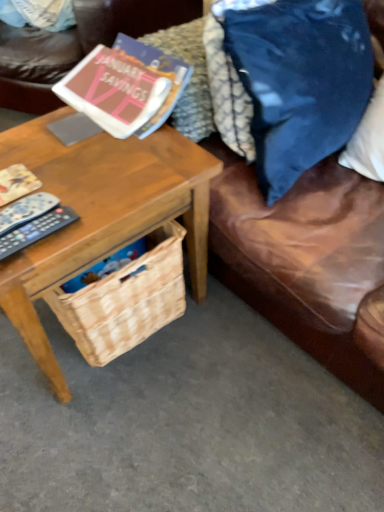
The width and height of the screenshot is (384, 512). What do you see at coordinates (300, 81) in the screenshot?
I see `blue velvet pillow at upper right` at bounding box center [300, 81].

Describe the element at coordinates (26, 210) in the screenshot. I see `black plastic remote at left, the 2th remote control from the bottom` at that location.

The image size is (384, 512). What are the coordinates of `matte paper book at upper left` in the screenshot? It's located at (126, 87).

Is brown leather couch at lower right located within woodenobject at left?

No, brown leather couch at lower right is located outside of woodenobject at left.

Does woodenobject at left turn towards brown leather couch at lower right?

No, woodenobject at left is not facing towards brown leather couch at lower right.

Can you confirm if woodenobject at left is bigger than brown leather couch at lower right?

No.

Is woodenobject at left closer to the viewer compared to brown leather couch at lower right?

No, the depth of woodenobject at left is greater than that of brown leather couch at lower right.

Between blue velvet pillow at upper right and black plastic remote at left, which is the 1th remote control from top to bottom, which one has smaller width?

With smaller width is black plastic remote at left, which is the 1th remote control from top to bottom.

From the image's perspective, is blue velvet pillow at upper right located above black plastic remote at left, which is the 1th remote control from top to bottom?

Yes.

In the scene shown: Is blue velvet pillow at upper right spatially inside black plastic remote at left, the 2th remote control from the bottom, or outside of it?

blue velvet pillow at upper right exists outside the volume of black plastic remote at left, the 2th remote control from the bottom.

Is black plastic remote control at left, the second remote control positioned from the top, with black plastic remote at left, the 2th remote control from the bottom?

Yes, black plastic remote control at left, the second remote control positioned from the top, is in contact with black plastic remote at left, the 2th remote control from the bottom.

From a real-world perspective, is black plastic remote control at left, which is counted as the first remote control, starting from the bottom, above or below black plastic remote at left, which is the 1th remote control from top to bottom?

black plastic remote control at left, which is counted as the first remote control, starting from the bottom, is below black plastic remote at left, which is the 1th remote control from top to bottom.

Is black plastic remote control at left, the second remote control positioned from the top, oriented towards black plastic remote at left, the 2th remote control from the bottom?

No, black plastic remote control at left, the second remote control positioned from the top, does not turn towards black plastic remote at left, the 2th remote control from the bottom.

Based on their positions, is black plastic remote control at left, the second remote control positioned from the top, located to the left or right of black plastic remote at left, the 2th remote control from the bottom?

In the image, black plastic remote control at left, the second remote control positioned from the top, appears on the right side of black plastic remote at left, the 2th remote control from the bottom.

From the image's perspective, between black plastic remote control at left, the second remote control positioned from the top, and brown leather couch at lower right, which one is located above?

From the image's view, brown leather couch at lower right is above.

From the picture: Could you tell me if black plastic remote control at left, which is counted as the first remote control, starting from the bottom, is turned towards brown leather couch at lower right?

No, black plastic remote control at left, which is counted as the first remote control, starting from the bottom, is not facing towards brown leather couch at lower right.

What's the angular difference between black plastic remote control at left, the second remote control positioned from the top, and brown leather couch at lower right's facing directions?

0.705 degrees.

Can you confirm if black plastic remote control at left, the second remote control positioned from the top, is bigger than brown leather couch at lower right?

Actually, black plastic remote control at left, the second remote control positioned from the top, might be smaller than brown leather couch at lower right.

Is black plastic remote at left, the 2th remote control from the bottom, not close to brown leather couch at lower right?

No, black plastic remote at left, the 2th remote control from the bottom, is in close proximity to brown leather couch at lower right.

How different are the orientations of black plastic remote at left, the 2th remote control from the bottom, and brown leather couch at lower right in degrees?

black plastic remote at left, the 2th remote control from the bottom, and brown leather couch at lower right are facing 7.22 degrees away from each other.

Is black plastic remote at left, the 2th remote control from the bottom, facing towards brown leather couch at lower right?

No, black plastic remote at left, the 2th remote control from the bottom, is not oriented towards brown leather couch at lower right.

Based on the photo, can you tell me how much black plastic remote at left, the 2th remote control from the bottom, and woodenobject at left differ in facing direction?

black plastic remote at left, the 2th remote control from the bottom, and woodenobject at left are facing 10.6 degrees away from each other.

Which object is wider, black plastic remote at left, the 2th remote control from the bottom, or woodenobject at left?

woodenobject at left is wider.

Can you confirm if black plastic remote at left, the 2th remote control from the bottom, is taller than woodenobject at left?

In fact, black plastic remote at left, the 2th remote control from the bottom, may be shorter than woodenobject at left.

From a real-world perspective, is black plastic remote at left, the 2th remote control from the bottom, positioned above or below woodenobject at left?

In terms of real-world spatial position, black plastic remote at left, the 2th remote control from the bottom, is above woodenobject at left.

From a real-world perspective, which object stands above the other?

In real-world perspective, black plastic remote at left, the 2th remote control from the bottom, is above.

At what (x,y) coordinates should I click in order to perform the action: click on the 2nd remote control counting from the left of the brown leather couch at lower right. Please return your answer as a coordinate pair (x, y). The height and width of the screenshot is (512, 384). Looking at the image, I should click on (26, 210).

Does brown leather couch at lower right contain black plastic remote at left, the 2th remote control from the bottom?

Actually, black plastic remote at left, the 2th remote control from the bottom, is outside brown leather couch at lower right.

You are a GUI agent. You are given a task and a screenshot of the screen. Output one action in this format:
    pyautogui.click(x=<x>, y=<y>)
    Task: Click on the couch above the woodenobject at left (from the image's perspective)
    The height and width of the screenshot is (512, 384).
    Given the screenshot: What is the action you would take?
    pyautogui.click(x=307, y=261)

Locate an element on the screen. The image size is (384, 512). throw pillow located above the black plastic remote at left, which is the 1th remote control from top to bottom (from a real-world perspective) is located at coordinates (300, 81).

Based on their spatial positions, is black plastic remote control at left, the second remote control positioned from the top, or brown leather couch at lower right closer to blue velvet pillow at upper right?

brown leather couch at lower right lies closer to blue velvet pillow at upper right than the other object.

Estimate the real-world distances between objects in this image. Which object is further from black plastic remote at left, which is the 1th remote control from top to bottom, blue velvet pillow at upper right or woodenobject at left?

The object further to black plastic remote at left, which is the 1th remote control from top to bottom, is blue velvet pillow at upper right.

Based on their spatial positions, is black plastic remote at left, which is the 1th remote control from top to bottom, or blue velvet pillow at upper right closer to woodenobject at left?

The object closer to woodenobject at left is black plastic remote at left, which is the 1th remote control from top to bottom.

Estimate the real-world distances between objects in this image. Which object is closer to black plastic remote control at left, which is counted as the first remote control, starting from the bottom, brown leather couch at lower right or black plastic remote at left, which is the 1th remote control from top to bottom?

black plastic remote at left, which is the 1th remote control from top to bottom, is closer to black plastic remote control at left, which is counted as the first remote control, starting from the bottom.

Estimate the real-world distances between objects in this image. Which object is further from matte paper book at upper left, brown leather couch at lower right or woodenobject at left?

Among the two, brown leather couch at lower right is located further to matte paper book at upper left.

From the image, which object appears to be nearer to black plastic remote at left, which is the 1th remote control from top to bottom, woodenobject at left or black plastic remote control at left, the second remote control positioned from the top?

The object closer to black plastic remote at left, which is the 1th remote control from top to bottom, is black plastic remote control at left, the second remote control positioned from the top.

Which object lies nearer to the anchor point brown leather couch at lower right, woodenobject at left or blue velvet pillow at upper right?

The object closer to brown leather couch at lower right is blue velvet pillow at upper right.

When comparing their distances from brown leather couch at lower right, does black plastic remote at left, which is the 1th remote control from top to bottom, or matte paper book at upper left seem closer?

Among the two, matte paper book at upper left is located nearer to brown leather couch at lower right.

Where is `book located between black plastic remote at left, the 2th remote control from the bottom, and blue velvet pillow at upper right in the left-right direction`? Image resolution: width=384 pixels, height=512 pixels. book located between black plastic remote at left, the 2th remote control from the bottom, and blue velvet pillow at upper right in the left-right direction is located at coordinates (126, 87).

Image resolution: width=384 pixels, height=512 pixels. I want to click on throw pillow situated between black plastic remote control at left, which is counted as the first remote control, starting from the bottom, and brown leather couch at lower right from left to right, so click(x=300, y=81).

At what (x,y) coordinates should I click in order to perform the action: click on table between black plastic remote control at left, the second remote control positioned from the top, and blue velvet pillow at upper right, in the horizontal direction. Please return your answer as a coordinate pair (x, y). The width and height of the screenshot is (384, 512). Looking at the image, I should click on (101, 213).

Image resolution: width=384 pixels, height=512 pixels. In order to click on book between woodenobject at left and blue velvet pillow at upper right in the horizontal direction in this screenshot , I will do `click(126, 87)`.